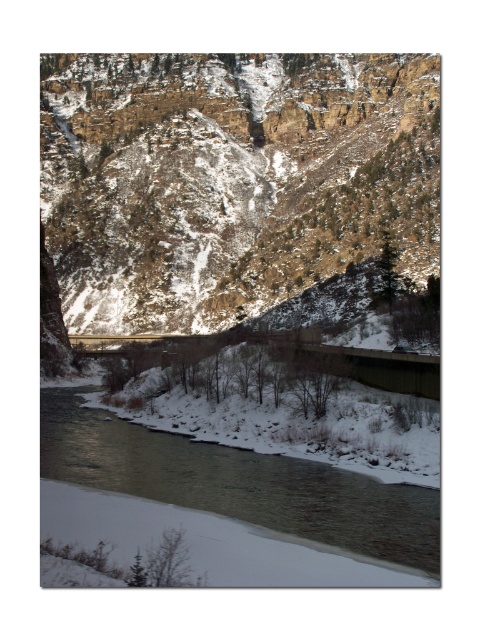
You are an explorer trying to cross the river. The rocky brown cliff at center is blocking your path. Can you go around it to reach the snowy river at lower center?

The snowy river at lower center is behind the rocky brown cliff at center, so you can go around the rocky brown cliff at center to reach the snowy river at lower center.

You are planning to build a small cabin. You have two options for locations near the rocky brown cliff at center and the snowy river at lower center. Which location would provide a higher elevation for better visibility?

The rocky brown cliff at center has a greater height compared to the snowy river at lower center, so building the cabin near the rocky brown cliff at center would provide a higher elevation for better visibility.